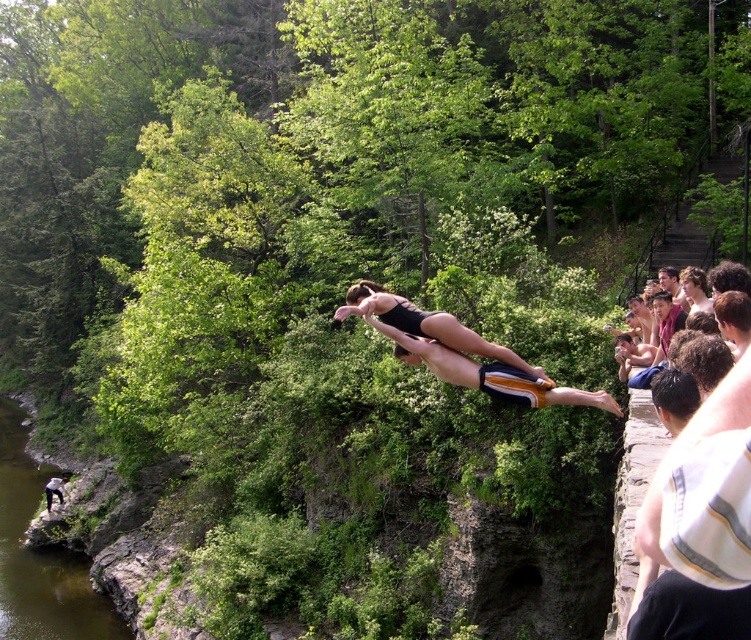
You are a photographer trying to capture the cliff divers in the image. You want to position your camera so that the white striped shirt at right and green smooth water at lower left are both in frame. Based on their positions, which object should you adjust your camera to focus on first to ensure both are visible?

The white striped shirt at right is to the right of green smooth water at lower left, so you should focus on the white striped shirt at right first to ensure both are visible in the frame.

You are analyzing a diving photo and need to locate the white striped shirt at right. What are its coordinates in the image?

The white striped shirt at right is located at coordinates (698, 525).